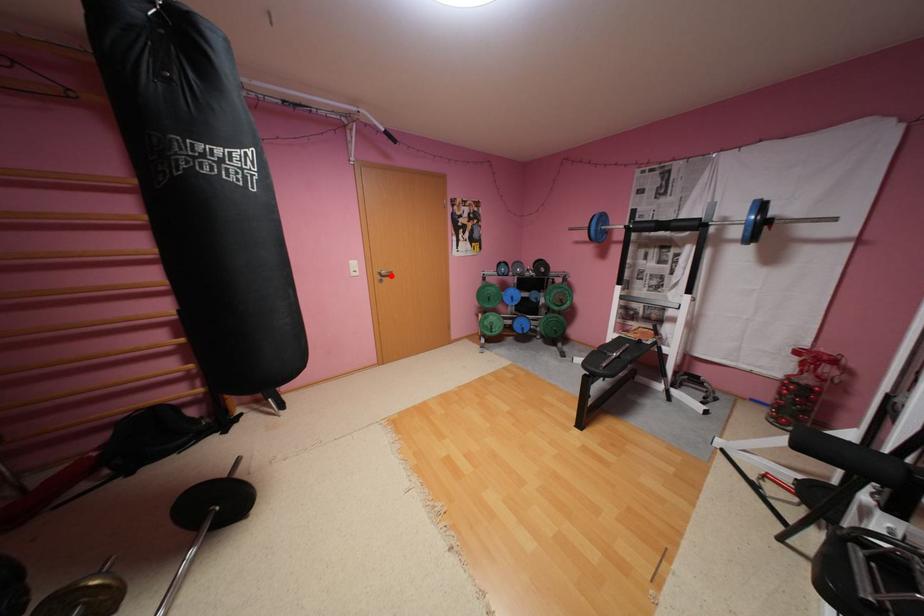
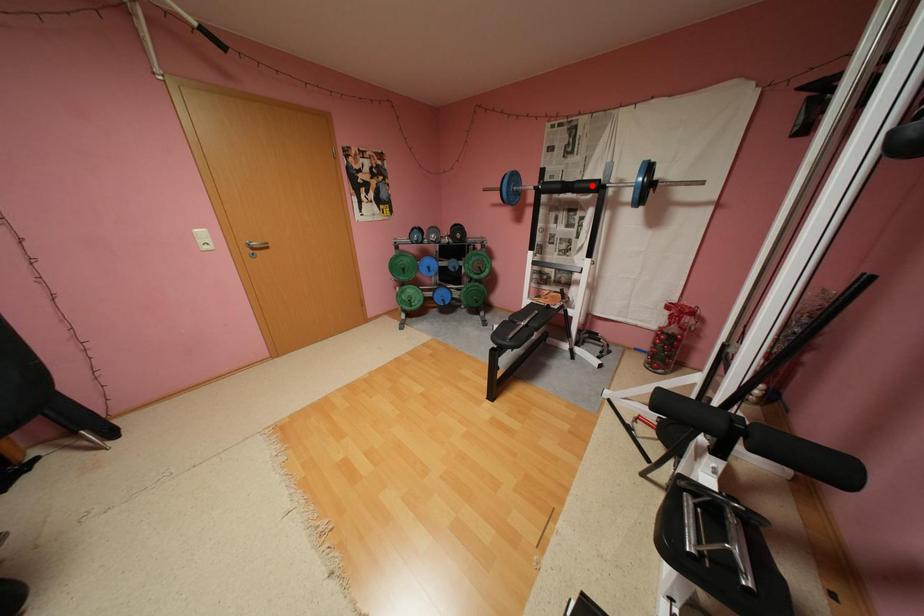
I am providing you with two images of the same scene from different viewpoints. A red point is marked on the first image and another point is marked on the second image. Do the highlighted points in image1 and image2 indicate the same real-world spot?

No